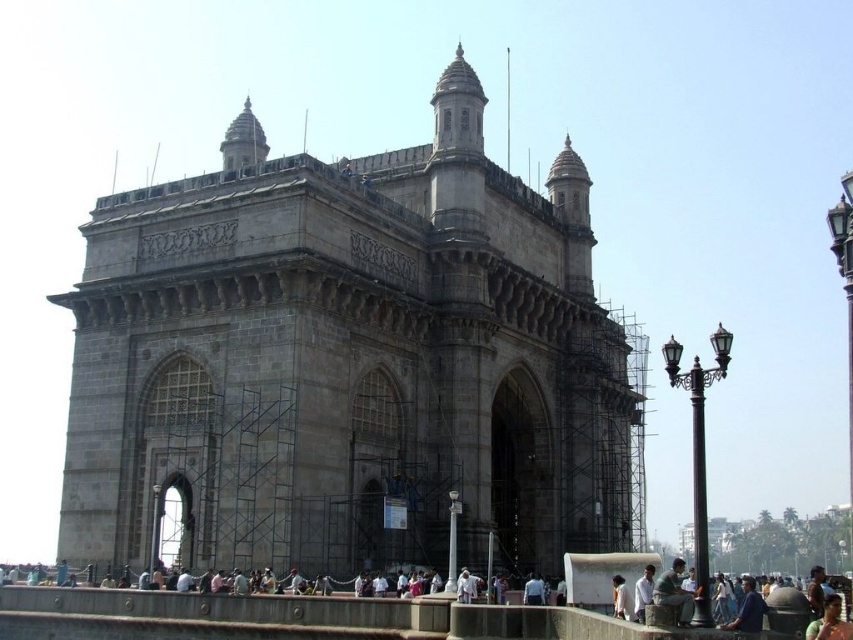
Question: Is gray stone gateway of india at center further to the viewer compared to light blue shirt at lower right?

Choices:
 (A) yes
 (B) no

Answer: (A)

Question: Which of the following is the closest to the observer?

Choices:
 (A) light blue shirt at lower right
 (B) gray stone gateway of india at center
 (C) light brown leather jacket at lower center

Answer: (A)

Question: Where is light blue shirt at lower right located in relation to light brown leather jacket at lower center in the image?

Choices:
 (A) above
 (B) below

Answer: (B)

Question: Does gray stone gateway of india at center have a smaller size compared to light brown leather jacket at lower center?

Choices:
 (A) no
 (B) yes

Answer: (A)

Question: Estimate the real-world distances between objects in this image. Which object is farther from the light brown leather jacket at lower center?

Choices:
 (A) light blue shirt at lower right
 (B) gray stone gateway of india at center

Answer: (B)

Question: Which point appears farthest from the camera in this image?

Choices:
 (A) (675, 561)
 (B) (614, 596)
 (C) (548, 416)

Answer: (C)